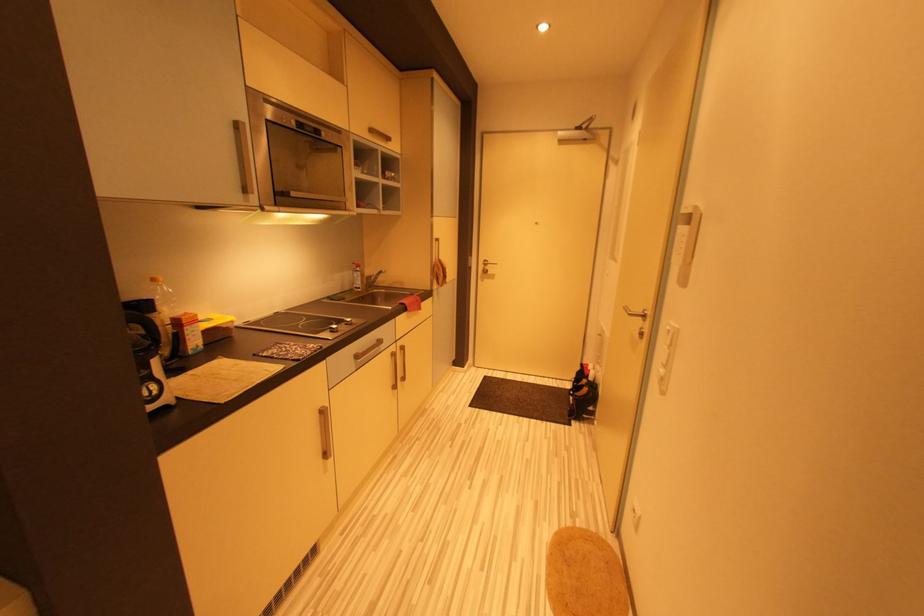
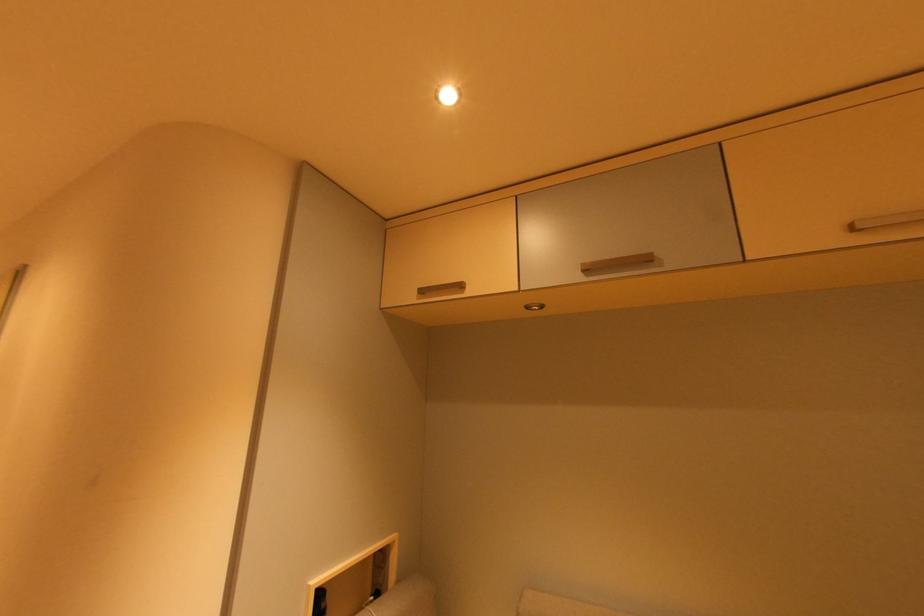
The first image is from the beginning of the video and the second image is from the end. How did the camera likely rotate when shooting the video?

The camera's rotation is toward right-up.